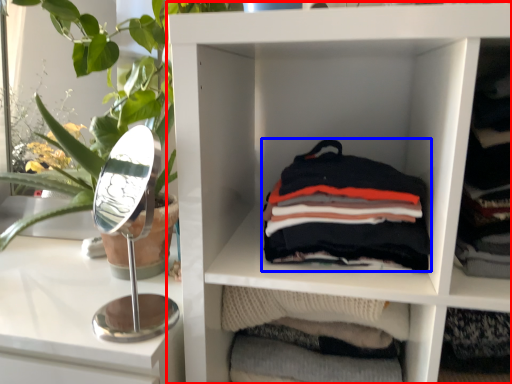
Question: Which object appears farthest to the camera in this image, shelf (highlighted by a red box) or material (highlighted by a blue box)?

Choices:
 (A) shelf
 (B) material

Answer: (B)